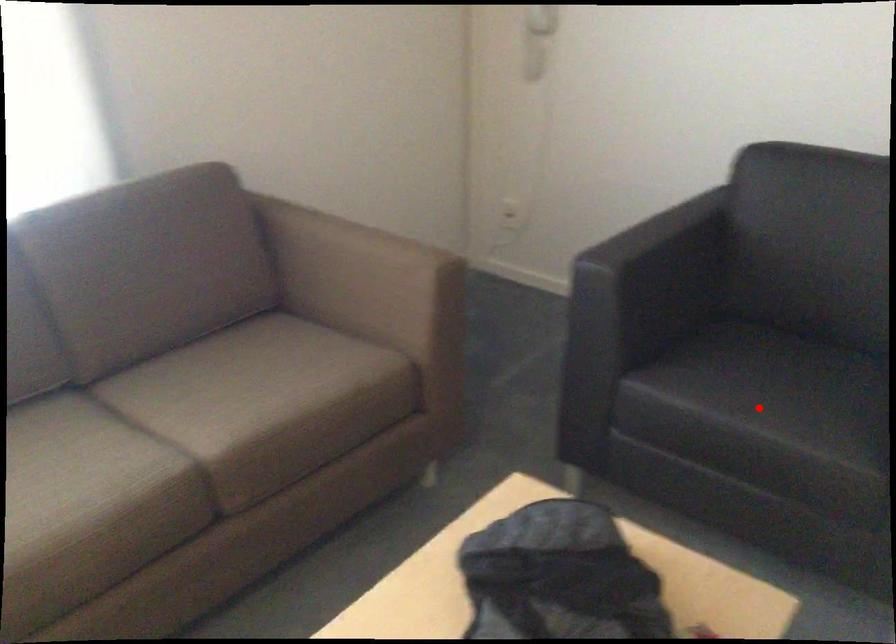
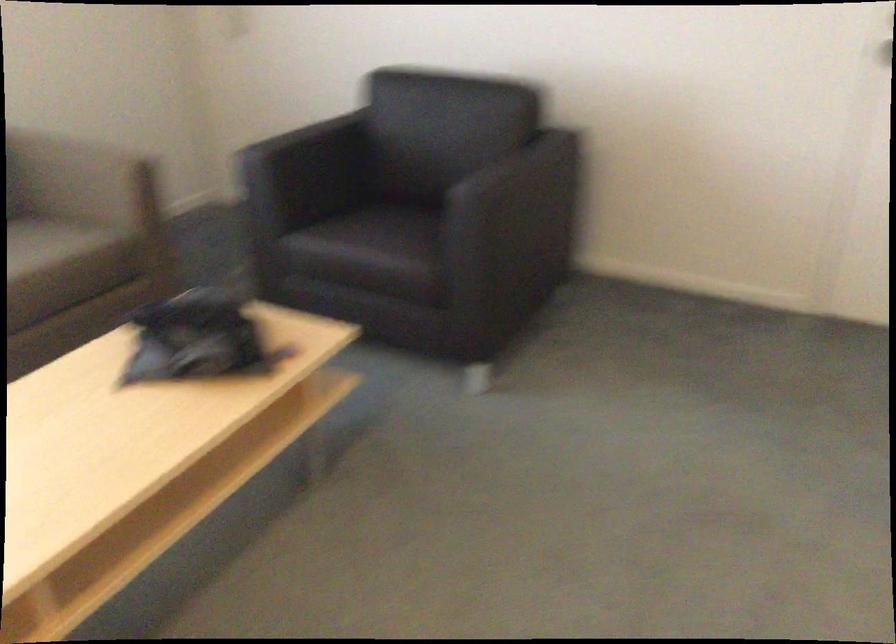
Question: I am providing you with two images of the same scene from different viewpoints. A red point is shown in image1. For the corresponding object point in image2, is it positioned nearer or farther from the camera?

Choices:
 (A) Nearer
 (B) Farther

Answer: (B)